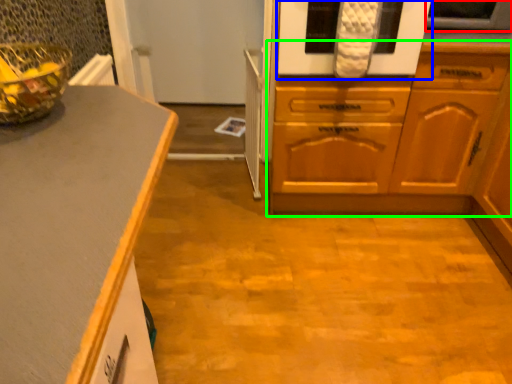
Question: Which object is the farthest from appliance (highlighted by a red box)? Choose among these: oven (highlighted by a blue box) or cabinetry (highlighted by a green box).

Choices:
 (A) oven
 (B) cabinetry

Answer: (B)